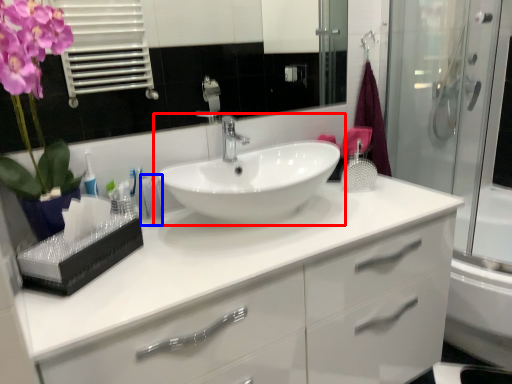
Question: Among these objects, which one is farthest to the camera, sink (highlighted by a red box) or toiletry (highlighted by a blue box)?

Choices:
 (A) sink
 (B) toiletry

Answer: (B)